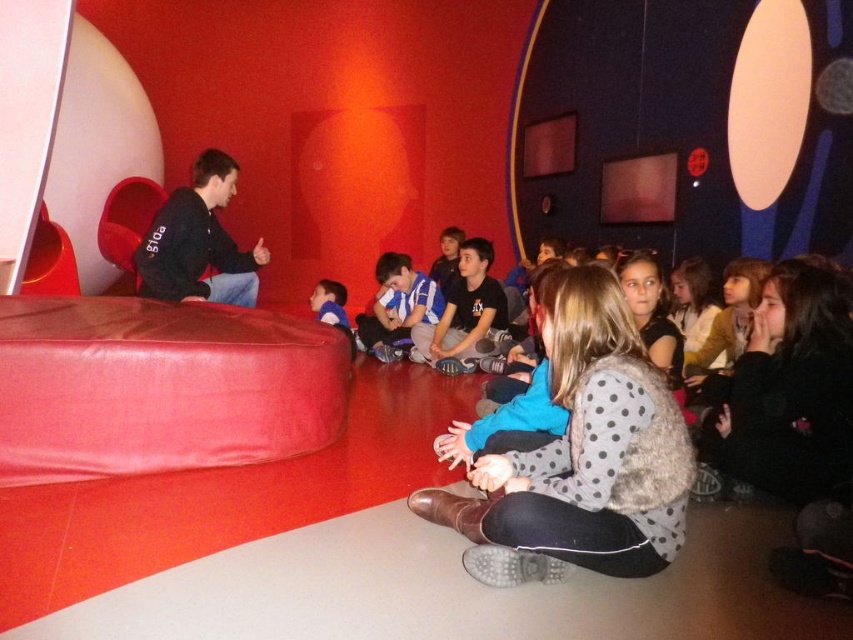
Question: Which point appears closest to the camera in this image?

Choices:
 (A) (529, 456)
 (B) (460, 264)
 (C) (181, 385)

Answer: (A)

Question: Is smooth red bean bag at left smaller than dark blue shirt at center?

Choices:
 (A) yes
 (B) no

Answer: (B)

Question: Which of these objects is positioned farthest from the smooth red bean bag at left?

Choices:
 (A) matte black sweater at left
 (B) polka dot sweater at center

Answer: (B)

Question: Considering the relative positions of smooth red bean bag at left and dark blue shirt at center in the image provided, where is smooth red bean bag at left located with respect to dark blue shirt at center?

Choices:
 (A) below
 (B) above

Answer: (A)

Question: Is smooth red bean bag at left to the left of polka dot sweater at center from the viewer's perspective?

Choices:
 (A) no
 (B) yes

Answer: (B)

Question: Which is farther from the smooth red bean bag at left?

Choices:
 (A) matte black sweater at left
 (B) polka dot sweater at center
 (C) dark blue shirt at center

Answer: (C)